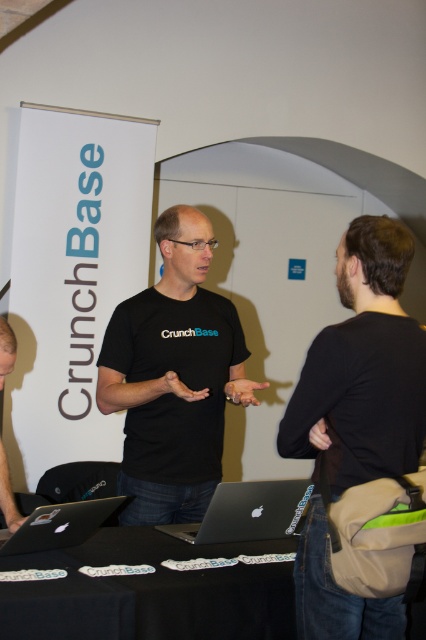
Question: Based on their relative distances, which object is nearer to the silver metallic laptop at center?

Choices:
 (A) black matte laptop at center
 (B) matte black t-shirt at center
 (C) black matte table at center
 (D) black fabric backpack at right

Answer: (B)

Question: Which point is closer to the camera?

Choices:
 (A) silver metallic laptop at center
 (B) black fabric backpack at right

Answer: (B)

Question: Can you confirm if black matte t-shirt at center is wider than silver metallic laptop at center?

Choices:
 (A) no
 (B) yes

Answer: (B)

Question: Which object appears closest to the camera in this image?

Choices:
 (A) black matte t-shirt at center
 (B) matte black t-shirt at center
 (C) silver metallic laptop at center

Answer: (C)

Question: Can you confirm if black matte laptop at center is positioned to the left of silver metallic laptop at center?

Choices:
 (A) yes
 (B) no

Answer: (B)

Question: Is silver metallic laptop at center positioned at the back of matte black t-shirt at center?

Choices:
 (A) yes
 (B) no

Answer: (B)